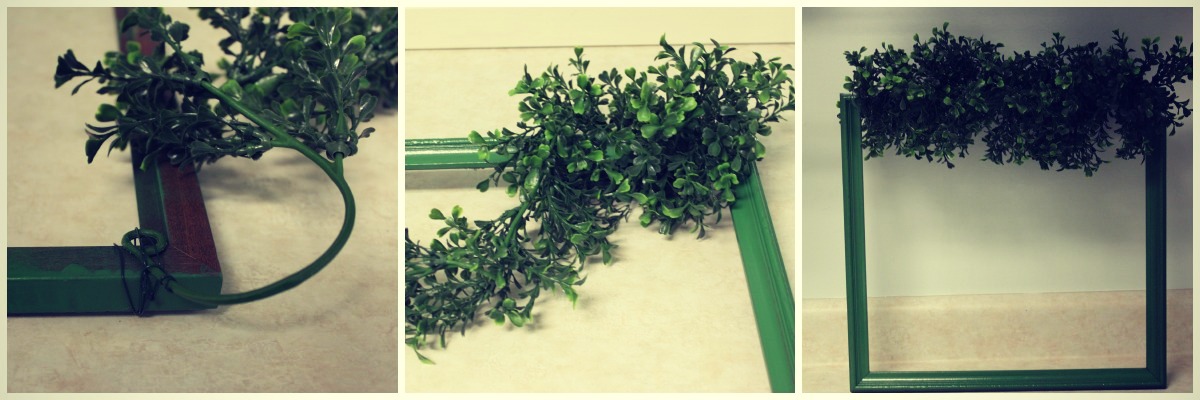
You are a GUI agent. You are given a task and a screenshot of the screen. Output one action in this format:
    pyautogui.click(x=<x>, y=<y>)
    Task: Click on the 1 !middle plant
    The width and height of the screenshot is (1200, 400).
    Given the screenshot: What is the action you would take?
    pyautogui.click(x=582, y=142)